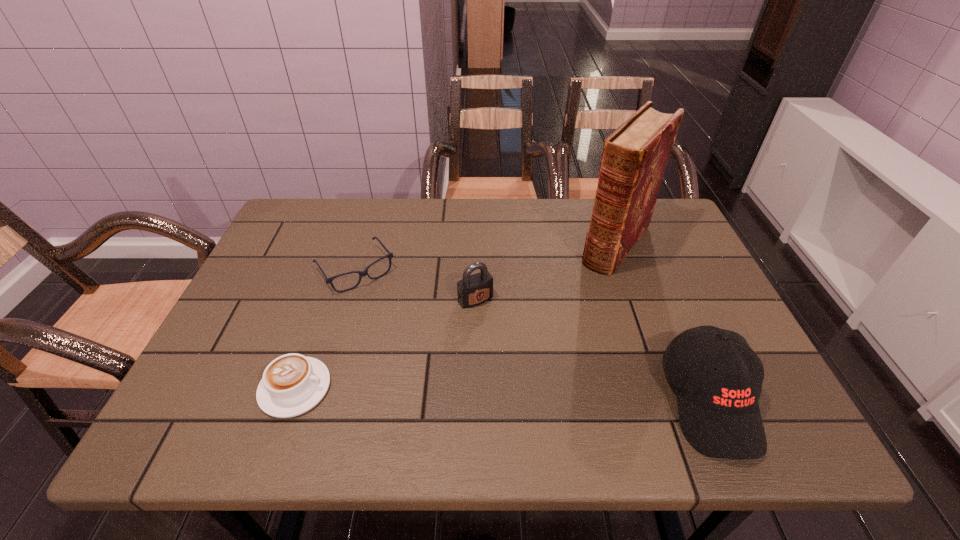
The image size is (960, 540). In order to click on vacant space on the desktop that is between the cappuccino and the baseball cap and is positioned on the front-facing side of the spectacles in this screenshot , I will do `click(444, 393)`.

Image resolution: width=960 pixels, height=540 pixels. I want to click on vacant spot on the desktop that is between the cappuccino and the baseball cap and is positioned on the front of the padlock near the keyhole, so click(547, 396).

Where is `free spot on the desktop that is between the cappuccino and the baseball cap and is positioned on the spine side of the tallest object`? free spot on the desktop that is between the cappuccino and the baseball cap and is positioned on the spine side of the tallest object is located at coordinates (497, 394).